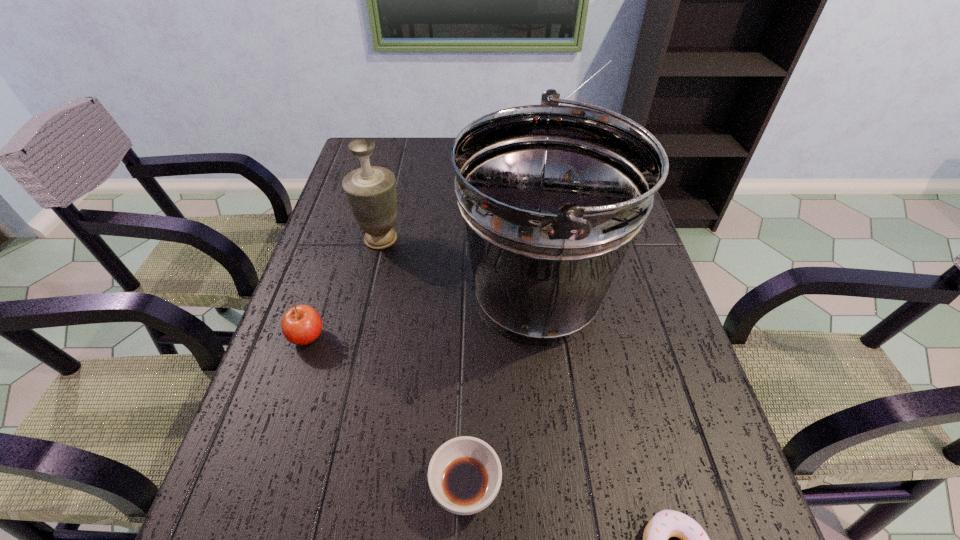
At what (x,y) coordinates should I click in order to perform the action: click on bucket. Please return your answer as a coordinate pair (x, y). The width and height of the screenshot is (960, 540). Looking at the image, I should click on tap(551, 196).

This screenshot has width=960, height=540. What are the coordinates of `the farthest object` in the screenshot? It's located at (610, 60).

Where is `the second object from left to right`? the second object from left to right is located at coordinates (370, 191).

Where is `apple`? apple is located at coordinates (301, 325).

Identify the location of the fourth tallest object. (301, 325).

Where is `the fifth tallest object`? the fifth tallest object is located at coordinates (464, 475).

Find the location of a particular element. vacant space located 0.220m on the back of the bucket is located at coordinates (525, 192).

Identify the location of free spot located on the front-facing side of the farthest object. This screenshot has width=960, height=540. (564, 198).

Where is `free region located 0.290m on the back of the second object from left to right`? The width and height of the screenshot is (960, 540). free region located 0.290m on the back of the second object from left to right is located at coordinates (397, 167).

Identify the location of vacant region located on the front of the leftmost object. (294, 378).